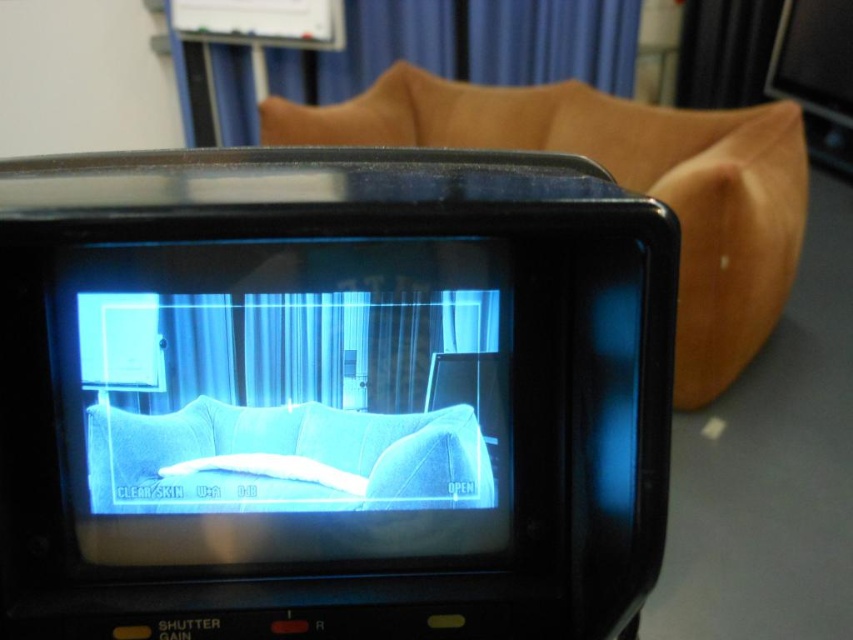
Question: Which of the following is the farthest from the observer?

Choices:
 (A) blue fabric couch at center
 (B) brown leather couch at upper center

Answer: (B)

Question: Is black plastic video camera at center closer to the viewer compared to brown leather couch at upper center?

Choices:
 (A) no
 (B) yes

Answer: (B)

Question: Can you confirm if blue fabric couch at center is thinner than brown leather couch at upper center?

Choices:
 (A) yes
 (B) no

Answer: (A)

Question: Which point is farther to the camera?

Choices:
 (A) (204, 333)
 (B) (724, 314)
 (C) (117, 452)

Answer: (B)

Question: Does black plastic video camera at center appear under blue fabric couch at center?

Choices:
 (A) yes
 (B) no

Answer: (B)

Question: Which point appears farthest from the camera in this image?

Choices:
 (A) (398, 122)
 (B) (387, 408)

Answer: (A)